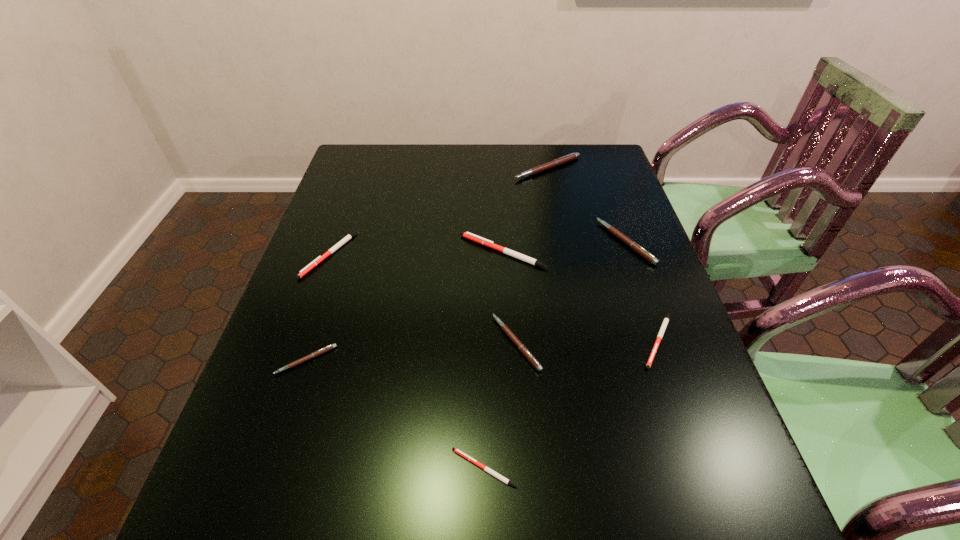
At what (x,y) coordinates should I click in order to perform the action: click on unoccupied area between the second biggest pink pen and the nearest object. Please return your answer as a coordinate pair (x, y). Looking at the image, I should click on (555, 355).

Where is `unoccupied position between the farthest object and the leftmost pink pen`? The height and width of the screenshot is (540, 960). unoccupied position between the farthest object and the leftmost pink pen is located at coordinates (427, 264).

Identify the location of empty space between the biggest white pen and the shortest object. The image size is (960, 540). (493, 360).

Where is `free spot between the farthest pink pen and the third farthest white pen`? free spot between the farthest pink pen and the third farthest white pen is located at coordinates (603, 254).

Locate an element on the screen. The height and width of the screenshot is (540, 960). vacant space that's between the third biggest white pen and the biggest white pen is located at coordinates (581, 296).

You are a GUI agent. You are given a task and a screenshot of the screen. Output one action in this format:
    pyautogui.click(x=<x>, y=<y>)
    Task: Click on the closest object to the farthest pen
    The image size is (960, 540).
    Given the screenshot: What is the action you would take?
    pyautogui.click(x=633, y=245)

Select which object appears as the second closest to the second smallest pink pen. Please provide its 2D coordinates. Your answer should be formatted as a tuple, i.e. [(x, y)], where the tuple contains the x and y coordinates of a point satisfying the conditions above.

[(485, 468)]

The width and height of the screenshot is (960, 540). I want to click on pen that stands as the fourth closest to the biggest white pen, so click(572, 156).

Locate which pen is the fifth closest to the third smallest white pen. Please provide its 2D coordinates. Your answer should be formatted as a tuple, i.e. [(x, y)], where the tuple contains the x and y coordinates of a point satisfying the conditions above.

[(572, 156)]

Point out which pink pen is positioned as the third nearest to the leftmost pink pen. Please provide its 2D coordinates. Your answer should be formatted as a tuple, i.e. [(x, y)], where the tuple contains the x and y coordinates of a point satisfying the conditions above.

[(572, 156)]